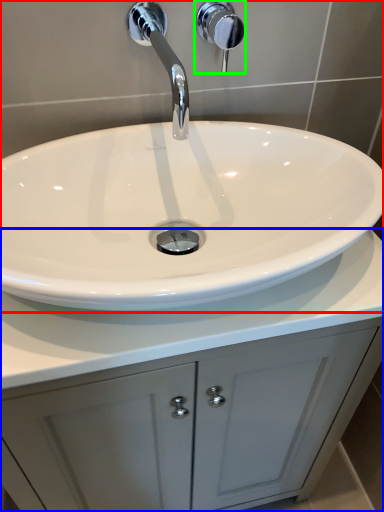
Question: Based on their relative distances, which object is farther from sink (highlighted by a red box)? Choose from bathroom cabinet (highlighted by a blue box) and shower (highlighted by a green box).

Choices:
 (A) bathroom cabinet
 (B) shower

Answer: (A)